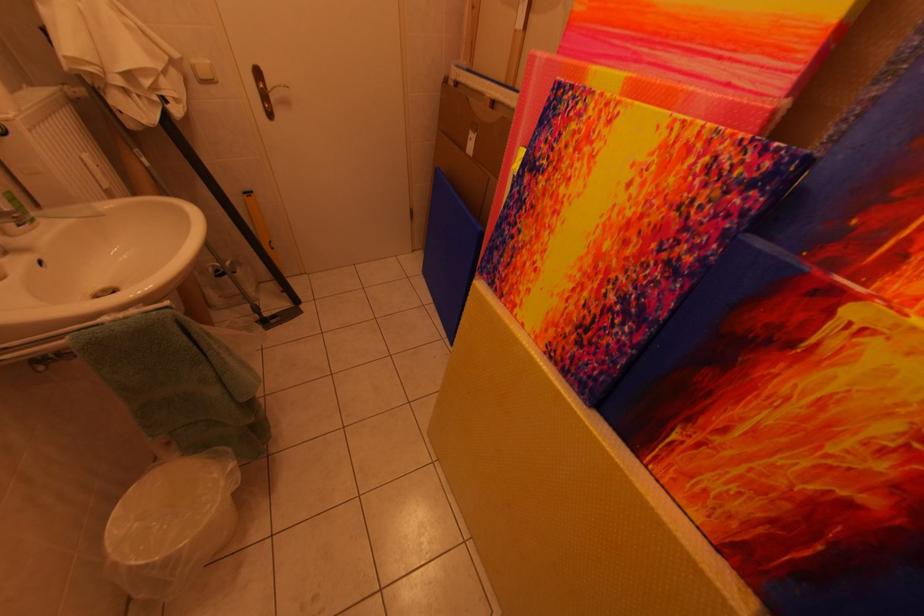
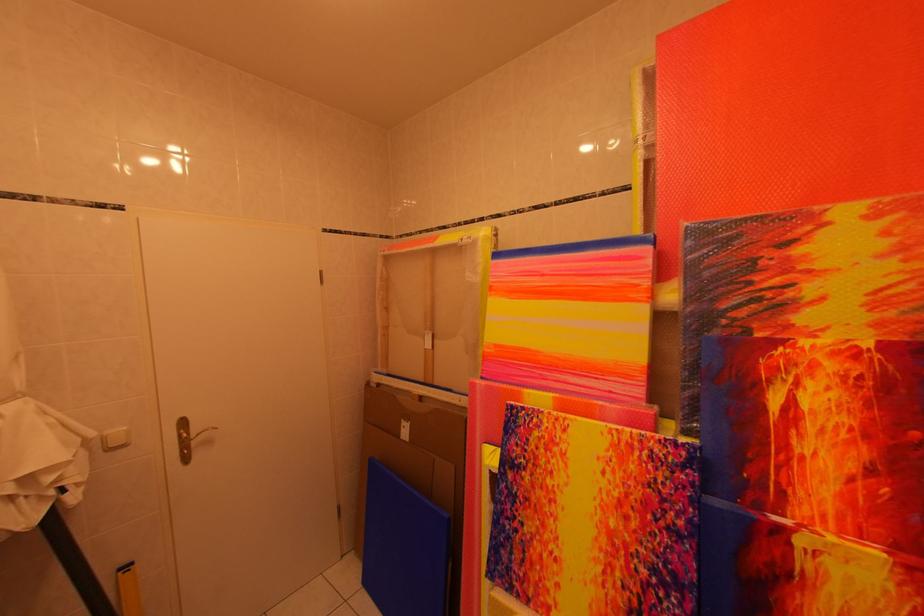
How did the camera likely rotate?

The rotation direction of the camera is right-up.